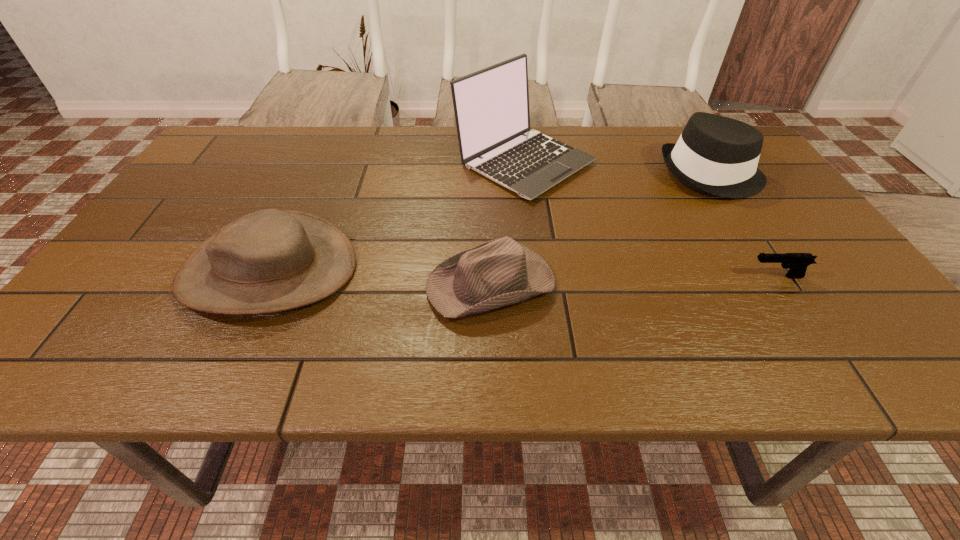
This screenshot has height=540, width=960. What are the coordinates of `laptop_computer` in the screenshot? It's located at click(x=491, y=106).

Image resolution: width=960 pixels, height=540 pixels. I want to click on the fourth shortest object, so point(715,155).

Where is `the farther fedora`? Image resolution: width=960 pixels, height=540 pixels. the farther fedora is located at coordinates (715, 155).

Where is `the leftmost object`? the leftmost object is located at coordinates (272, 260).

Find the location of a particular element. the second shortest object is located at coordinates (501, 272).

This screenshot has width=960, height=540. Identify the location of the nearer fedora. (501, 272).

The width and height of the screenshot is (960, 540). I want to click on pistol, so tap(797, 263).

Where is `vacant space located at the front screen of the tallest object`? The width and height of the screenshot is (960, 540). vacant space located at the front screen of the tallest object is located at coordinates [x=540, y=272].

This screenshot has height=540, width=960. What are the coordinates of `vacant position located 0.230m on the left of the taller fedora` in the screenshot? It's located at (575, 174).

Where is `free point located on the left of the leftmost object`? free point located on the left of the leftmost object is located at coordinates (126, 269).